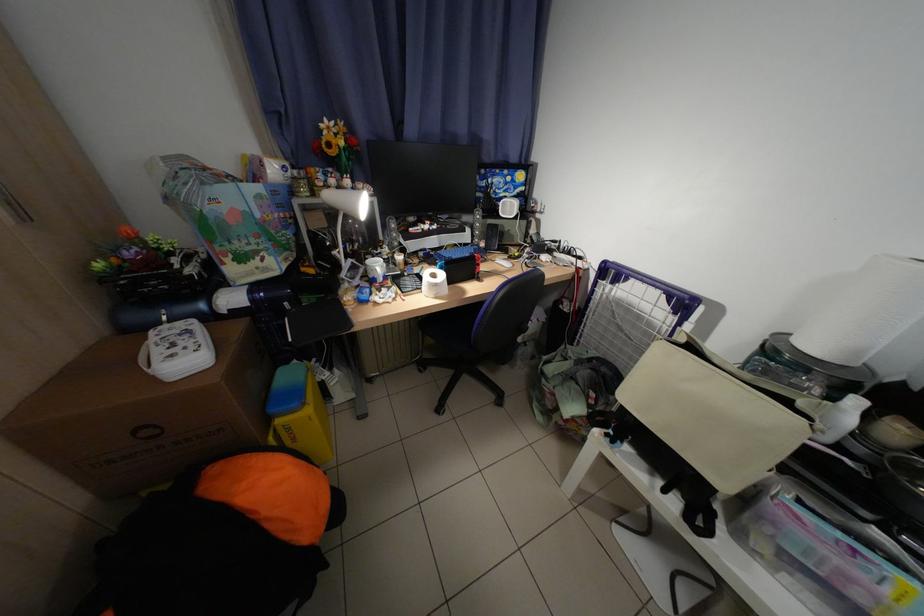
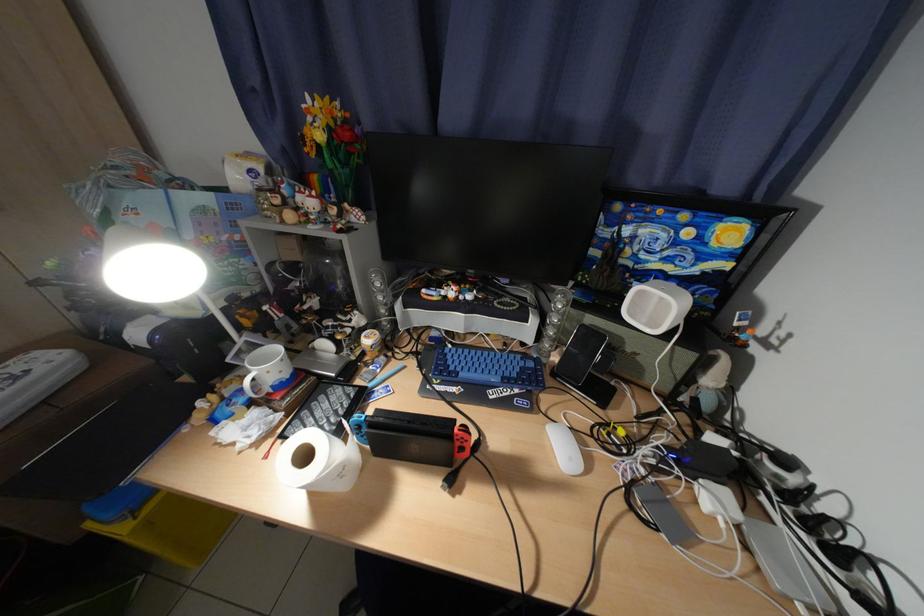
In the second image, find the point that corresponds to (x=409, y=300) in the first image.

(282, 444)